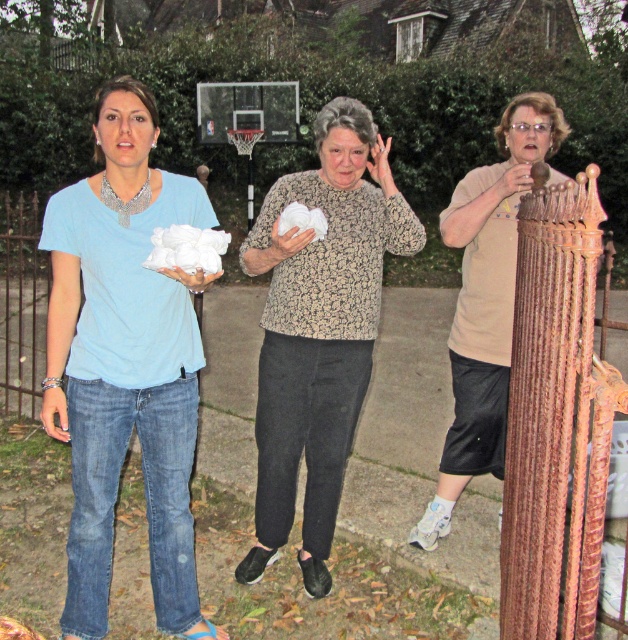
Can you confirm if matte blue shirt at center is positioned to the left of white textured sweater at center?

Yes, matte blue shirt at center is to the left of white textured sweater at center.

Between matte blue shirt at center and white textured sweater at center, which one is positioned lower?

matte blue shirt at center is below.

I want to click on matte blue shirt at center, so click(124, 362).

The height and width of the screenshot is (640, 628). Describe the element at coordinates (320, 330) in the screenshot. I see `white textured sweater at center` at that location.

Is white textured sweater at center bigger than beige matte shirt at right?

Actually, white textured sweater at center might be smaller than beige matte shirt at right.

What do you see at coordinates (320, 330) in the screenshot? This screenshot has height=640, width=628. I see `white textured sweater at center` at bounding box center [320, 330].

At what (x,y) coordinates should I click in order to perform the action: click on white textured sweater at center. Please return your answer as a coordinate pair (x, y). Looking at the image, I should click on (320, 330).

Between matte blue shirt at center and beige matte shirt at right, which one has less height?

Standing shorter between the two is beige matte shirt at right.

Is matte blue shirt at center thinner than beige matte shirt at right?

Yes, matte blue shirt at center is thinner than beige matte shirt at right.

What do you see at coordinates (124, 362) in the screenshot?
I see `matte blue shirt at center` at bounding box center [124, 362].

The image size is (628, 640). Find the location of `matte blue shirt at center`. matte blue shirt at center is located at coordinates (124, 362).